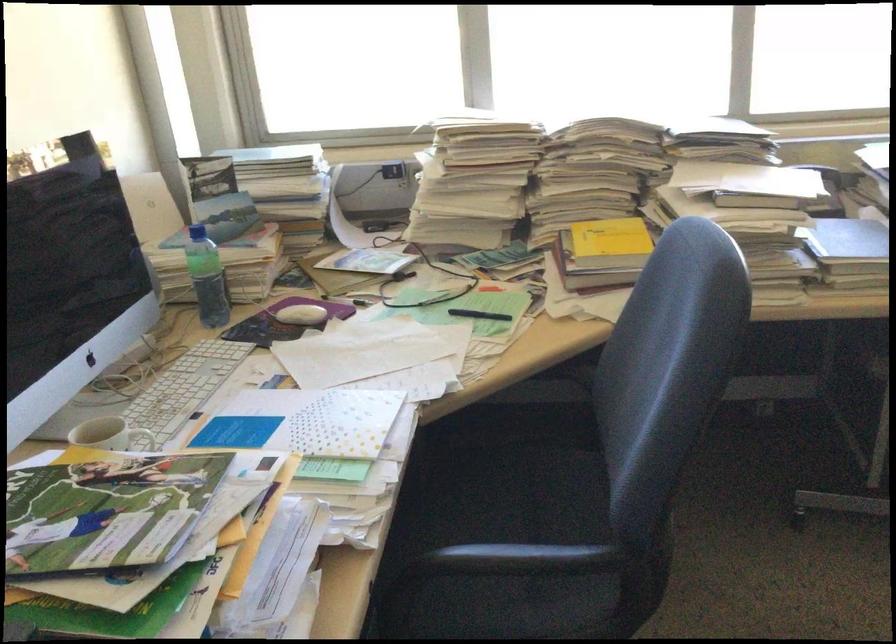
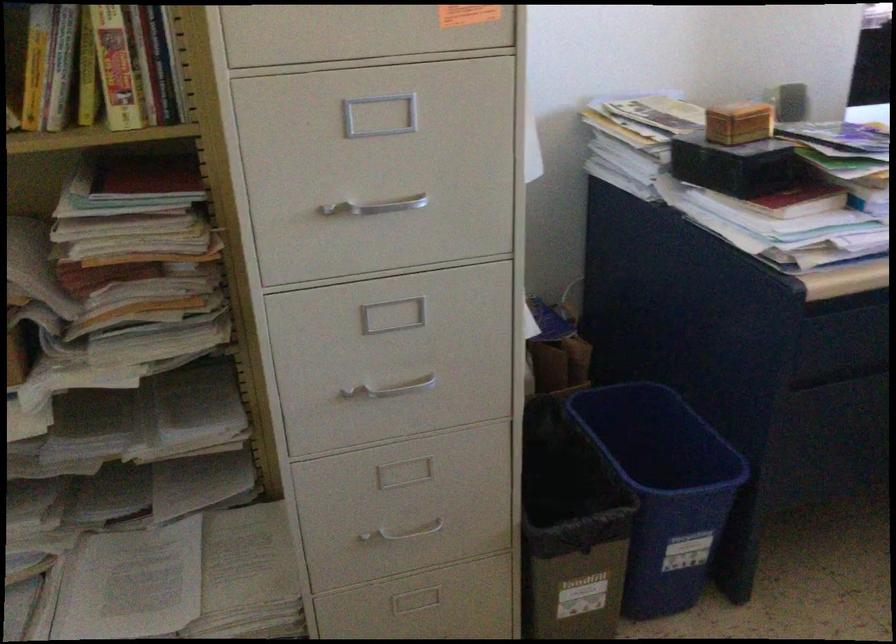
First-person continuous shooting, in which direction is the camera rotating?

The camera rotated toward left-down.